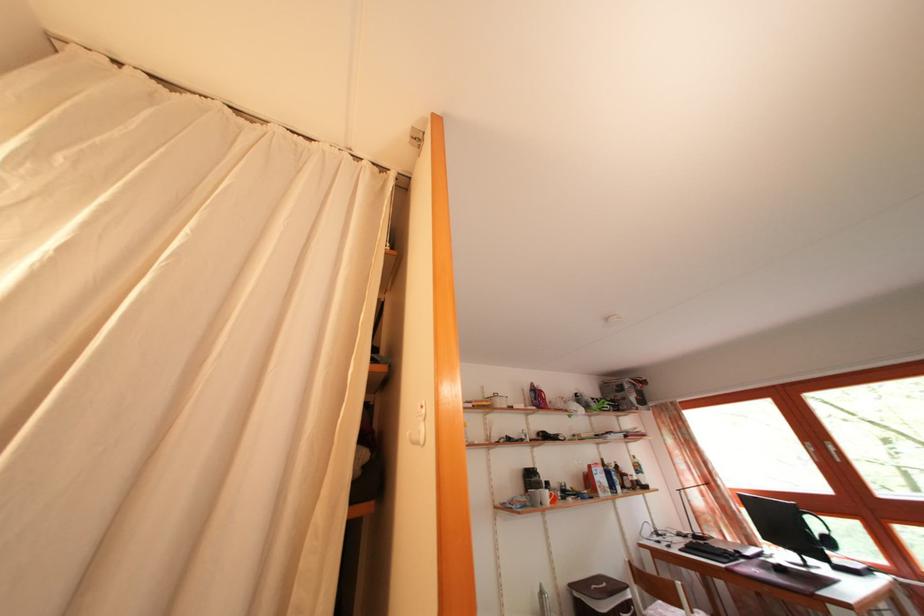
Where would you lift the dark glass bottle? Please return your answer as a coordinate pair (x, y).

(530, 479)